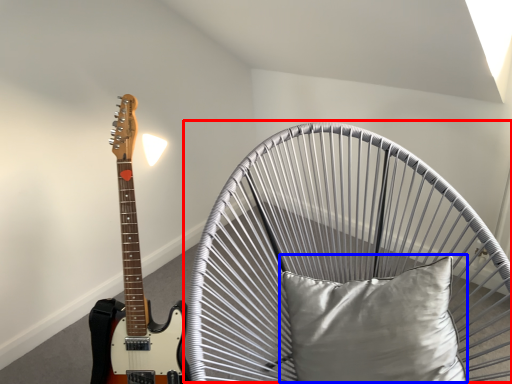
Question: Which point is closer to the camera, swivel chair (highlighted by a red box) or pillow (highlighted by a blue box)?

Choices:
 (A) swivel chair
 (B) pillow

Answer: (A)